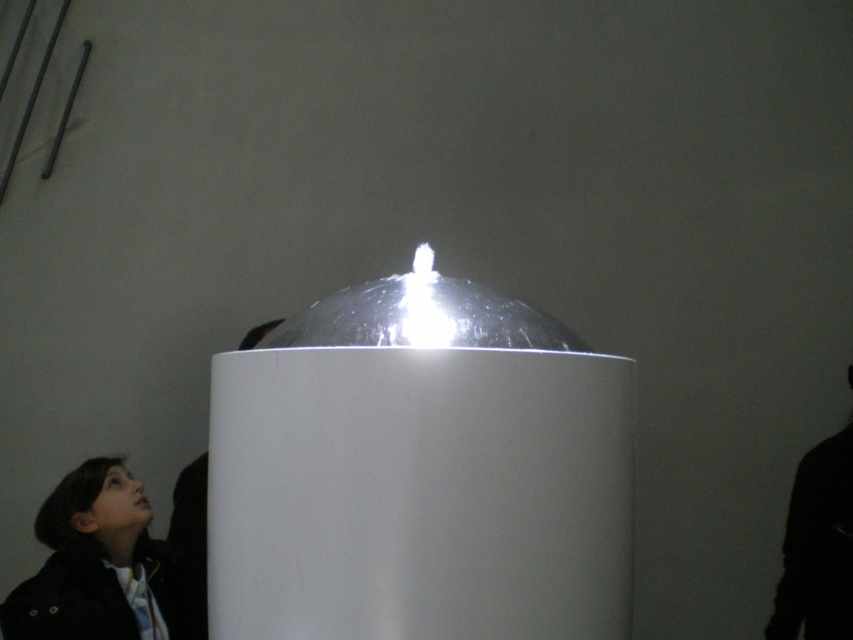
Question: Which is nearer to the transparent plastic dome at center?

Choices:
 (A) black matte jacket at right
 (B) black matte man at lower left
 (C) black fabric jacket at lower left

Answer: (C)

Question: Considering the relative positions of transparent plastic dome at center and black matte jacket at right in the image provided, where is transparent plastic dome at center located with respect to black matte jacket at right?

Choices:
 (A) below
 (B) above

Answer: (B)

Question: Which point appears closest to the camera in this image?

Choices:
 (A) (415, 554)
 (B) (172, 600)

Answer: (A)

Question: Is transparent plastic dome at center below black matte jacket at right?

Choices:
 (A) yes
 (B) no

Answer: (B)

Question: Which of the following is the closest to the observer?

Choices:
 (A) black fabric jacket at lower left
 (B) transparent plastic dome at center
 (C) black matte man at lower left
 (D) black matte jacket at right

Answer: (B)

Question: Can you confirm if transparent plastic dome at center is positioned above black matte man at lower left?

Choices:
 (A) no
 (B) yes

Answer: (B)